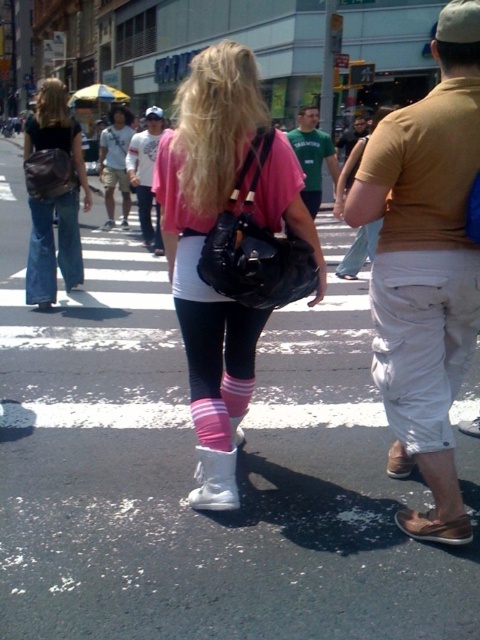
Question: Which point is closer to the camera?

Choices:
 (A) pos(215,417)
 (B) pos(157,106)

Answer: (A)

Question: In this image, where is matte brown purse at left located relative to white cotton t-shirt at center?

Choices:
 (A) left
 (B) right

Answer: (B)

Question: Which object is positioned closest to the white cotton shorts at lower right?

Choices:
 (A) green cotton shirt at center
 (B) white cotton shirt at center
 (C) white cotton t-shirt at center
 (D) matte brown purse at left

Answer: (A)

Question: Observing the image, what is the correct spatial positioning of white cotton shirt at center in reference to green cotton shirt at center?

Choices:
 (A) right
 (B) left

Answer: (B)

Question: Which object is positioned farthest from the green cotton shirt at center?

Choices:
 (A) pink matte leggings at center
 (B) matte yellow t-shirt at center
 (C) matte brown purse at left
 (D) white cotton t-shirt at center

Answer: (D)

Question: Can you confirm if matte yellow t-shirt at center is positioned above matte brown purse at left?

Choices:
 (A) no
 (B) yes

Answer: (A)